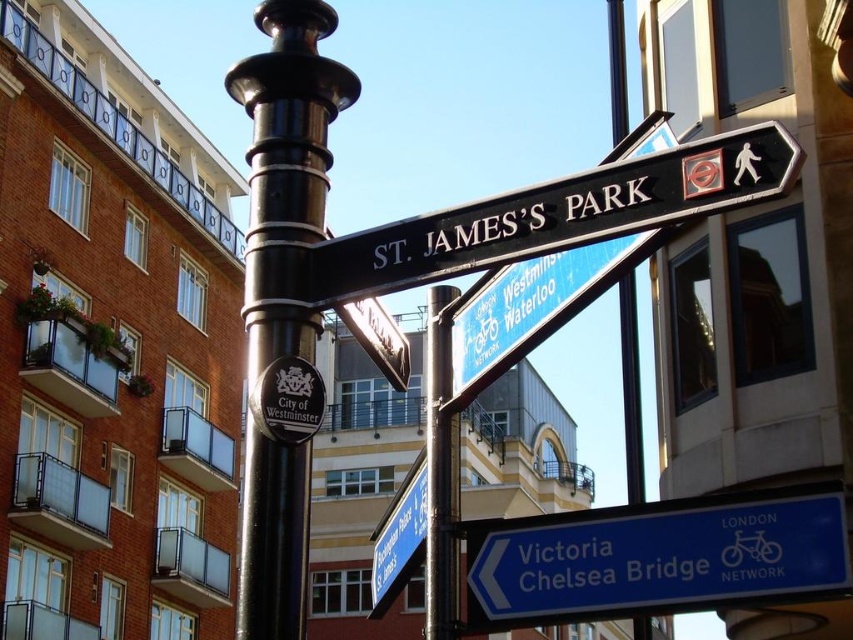
Can you confirm if black metal pole at center is positioned to the right of blue plastic street sign at lower center?

Yes, black metal pole at center is to the right of blue plastic street sign at lower center.

Between point (428, 460) and point (390, 602), which one is positioned behind?

Point (390, 602)

Describe the element at coordinates (440, 472) in the screenshot. I see `black metal pole at center` at that location.

The image size is (853, 640). Find the location of `black metal pole at center`. black metal pole at center is located at coordinates (440, 472).

Between point (521, 216) and point (412, 566), which one is positioned in front?

Point (521, 216)

What do you see at coordinates (558, 214) in the screenshot?
I see `black polished wood sign at upper center` at bounding box center [558, 214].

At what (x,y) coordinates should I click in order to perform the action: click on black polished wood sign at upper center. Please return your answer as a coordinate pair (x, y). Looking at the image, I should click on (558, 214).

Which is more to the right, blue plastic sign at lower right or black metal pole at center?

Positioned to the right is blue plastic sign at lower right.

This screenshot has width=853, height=640. What do you see at coordinates (656, 557) in the screenshot? I see `blue plastic sign at lower right` at bounding box center [656, 557].

You are a GUI agent. You are given a task and a screenshot of the screen. Output one action in this format:
    pyautogui.click(x=<x>, y=<y>)
    Task: Click on the blue plastic sign at lower right
    The height and width of the screenshot is (640, 853).
    Given the screenshot: What is the action you would take?
    pyautogui.click(x=656, y=557)

Where is `blue plastic sign at lower right`? Image resolution: width=853 pixels, height=640 pixels. blue plastic sign at lower right is located at coordinates (656, 557).